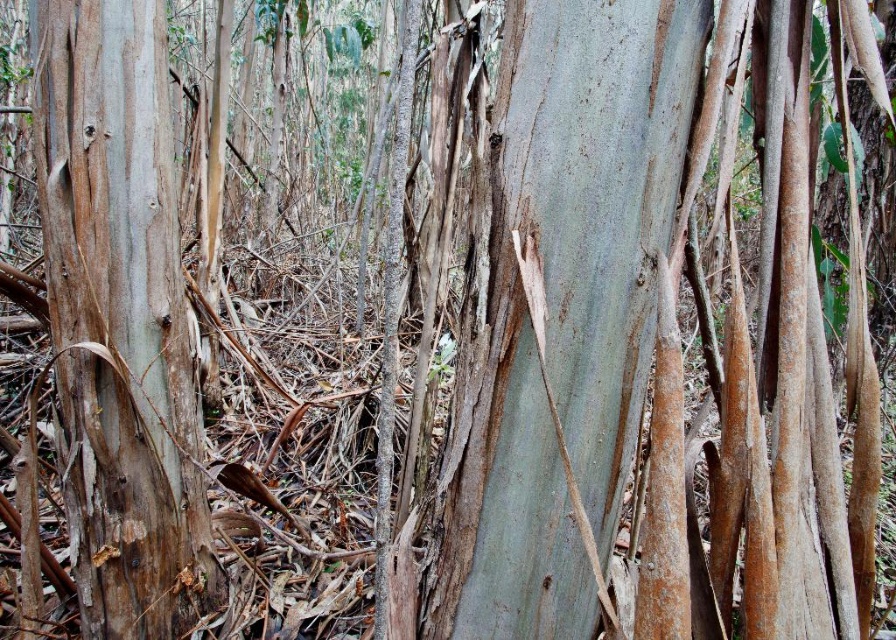
Does point (489, 506) come closer to viewer compared to point (164, 436)?

Yes.

I want to click on smooth gray bark at center, so click(x=560, y=308).